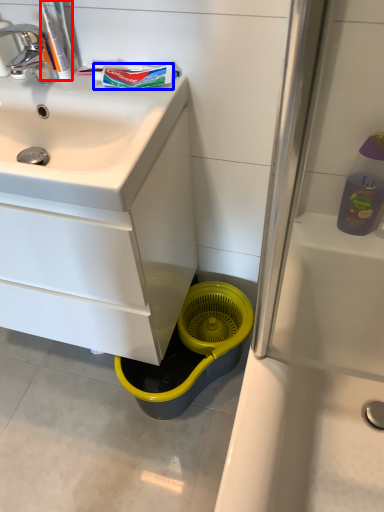
Question: Among these objects, which one is farthest to the camera, toothpaste (highlighted by a red box) or toothpaste (highlighted by a blue box)?

Choices:
 (A) toothpaste
 (B) toothpaste

Answer: (B)